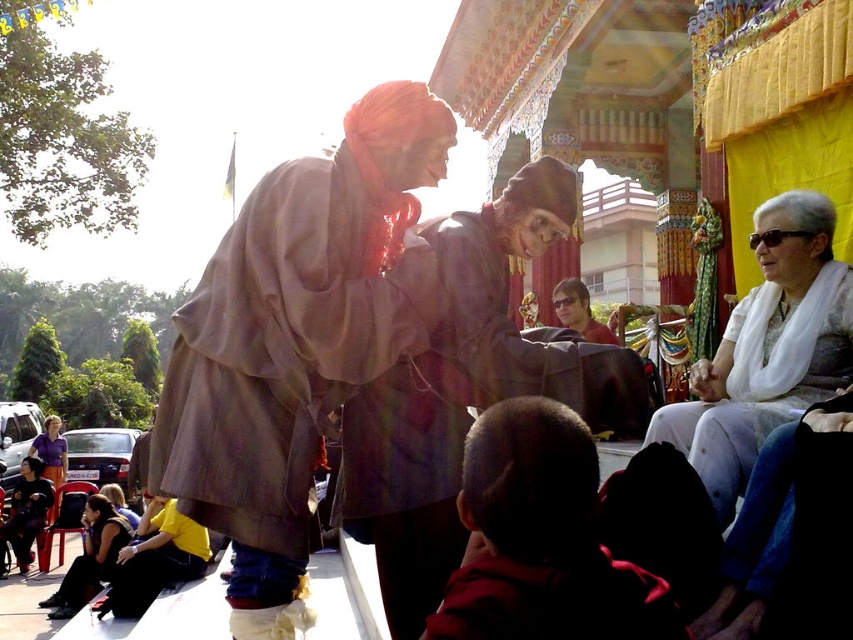
Which is in front, point (410, 465) or point (61, 448)?

Positioned in front is point (410, 465).

Is point (573, 401) positioned in front of point (54, 420)?

Yes, point (573, 401) is closer to viewer.

At what (x,y) coordinates should I click in order to perform the action: click on brown textured robe at center. Please return your answer as a coordinate pair (x, y). Image resolution: width=853 pixels, height=640 pixels. Looking at the image, I should click on (468, 392).

Does velvet maroon robe at lower center appear on the right side of dark blue fabric at lower left?

Correct, you'll find velvet maroon robe at lower center to the right of dark blue fabric at lower left.

Which is more to the right, velvet maroon robe at lower center or dark blue fabric at lower left?

velvet maroon robe at lower center

Image resolution: width=853 pixels, height=640 pixels. In order to click on velvet maroon robe at lower center in this screenshot , I will do `click(555, 600)`.

The height and width of the screenshot is (640, 853). I want to click on velvet maroon robe at lower center, so click(x=555, y=600).

Can you confirm if matte brown robe at center is positioned to the left of yellow cotton shirt at lower left?

In fact, matte brown robe at center is to the right of yellow cotton shirt at lower left.

Does matte brown robe at center appear under yellow cotton shirt at lower left?

No, matte brown robe at center is not below yellow cotton shirt at lower left.

The width and height of the screenshot is (853, 640). What do you see at coordinates (297, 332) in the screenshot?
I see `matte brown robe at center` at bounding box center [297, 332].

Identify the location of matte brown robe at center. The height and width of the screenshot is (640, 853). (297, 332).